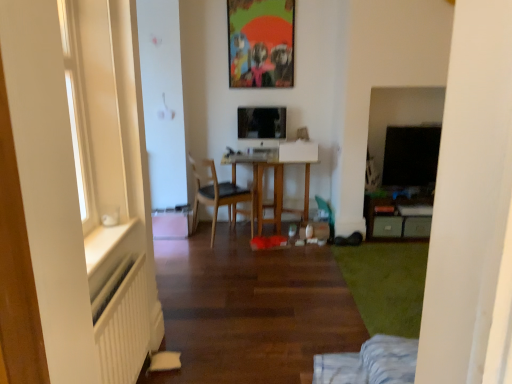
Question: Is wooden chair at center not close to wooden table at center?

Choices:
 (A) yes
 (B) no

Answer: (B)

Question: Considering the relative positions of wooden chair at center and wooden table at center in the image provided, is wooden chair at center to the left of wooden table at center from the viewer's perspective?

Choices:
 (A) yes
 (B) no

Answer: (A)

Question: Would you say wooden table at center is part of wooden chair at center's contents?

Choices:
 (A) no
 (B) yes

Answer: (A)

Question: Is wooden chair at center in contact with wooden table at center?

Choices:
 (A) no
 (B) yes

Answer: (A)

Question: Considering the relative sizes of wooden chair at center and wooden table at center in the image provided, is wooden chair at center shorter than wooden table at center?

Choices:
 (A) yes
 (B) no

Answer: (B)

Question: Is wooden chair at center inside the boundaries of black glossy tv at right, or outside?

Choices:
 (A) outside
 (B) inside

Answer: (A)

Question: Visually, is wooden chair at center positioned to the left or to the right of black glossy tv at right?

Choices:
 (A) right
 (B) left

Answer: (B)

Question: In terms of size, does wooden chair at center appear bigger or smaller than black glossy tv at right?

Choices:
 (A) big
 (B) small

Answer: (A)

Question: Is wooden chair at center in front of or behind black glossy tv at right in the image?

Choices:
 (A) front
 (B) behind

Answer: (A)

Question: Is point (230, 192) positioned closer to the camera than point (133, 370)?

Choices:
 (A) closer
 (B) farther

Answer: (B)

Question: Based on their positions, is wooden chair at center located to the left or right of white ribbed radiator at lower left?

Choices:
 (A) left
 (B) right

Answer: (B)

Question: From the image's perspective, is wooden chair at center located above or below white ribbed radiator at lower left?

Choices:
 (A) above
 (B) below

Answer: (A)

Question: Is wooden chair at center in front of or behind white ribbed radiator at lower left in the image?

Choices:
 (A) behind
 (B) front

Answer: (A)

Question: From a real-world perspective, is matte plastic picture frame at upper center above or below black glossy tv at right?

Choices:
 (A) below
 (B) above

Answer: (B)

Question: From the image's perspective, is matte plastic picture frame at upper center above or below black glossy tv at right?

Choices:
 (A) above
 (B) below

Answer: (A)